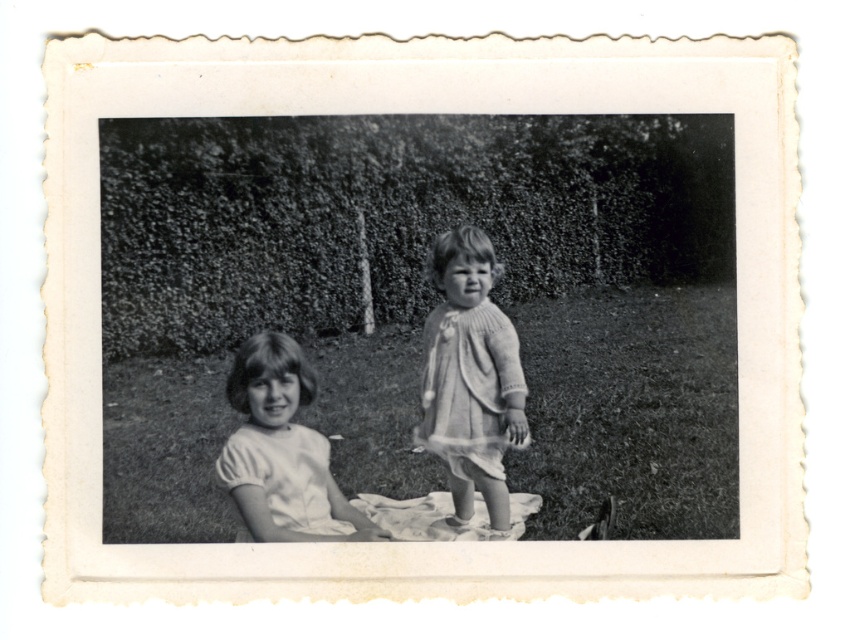
Question: Which point is closer to the camera taking this photo?

Choices:
 (A) (484, 468)
 (B) (361, 404)

Answer: (A)

Question: Among these objects, which one is farthest from the camera?

Choices:
 (A) knitted white dress at center
 (B) grassy lawn at center

Answer: (A)

Question: Can you confirm if white cotton shirt at left is wider than knitted white dress at center?

Choices:
 (A) yes
 (B) no

Answer: (A)

Question: Can you confirm if grassy lawn at center is bigger than white cotton shirt at left?

Choices:
 (A) yes
 (B) no

Answer: (A)

Question: Which is farther from the grassy lawn at center?

Choices:
 (A) white cotton shirt at left
 (B) knitted white dress at center

Answer: (B)

Question: Is grassy lawn at center to the right of knitted white dress at center from the viewer's perspective?

Choices:
 (A) yes
 (B) no

Answer: (B)